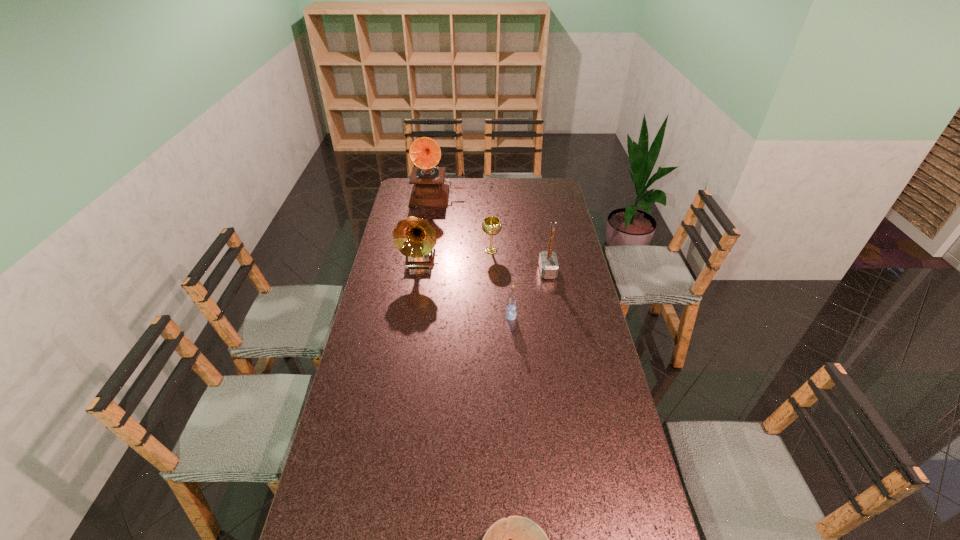
I want to click on vacant space in between the rightmost object and the shorter phonograph_record, so click(484, 266).

What are the coordinates of `vacant space in between the second nearest object and the rightmost object` in the screenshot? It's located at pos(529,294).

Locate an element on the screen. vacant region between the vodka and the tallest object is located at coordinates (474, 256).

In order to click on vacant point located between the hammer and the chalice in this screenshot , I will do `click(519, 261)`.

Identify which object is the third nearest to the second nearest object. Please provide its 2D coordinates. Your answer should be formatted as a tuple, i.e. [(x, y)], where the tuple contains the x and y coordinates of a point satisfying the conditions above.

[(415, 238)]

Where is `object that stands as the closest to the chalice`? object that stands as the closest to the chalice is located at coordinates (548, 263).

Locate an element on the screen. Image resolution: width=960 pixels, height=540 pixels. free space that satisfies the following two spatial constraints: 1. on the horn of the vodka; 2. on the right side of the farther phonograph_record is located at coordinates (420, 317).

Where is `free space that satisfies the following two spatial constraints: 1. on the horn of the vodka; 2. on the right side of the tallest object`? The height and width of the screenshot is (540, 960). free space that satisfies the following two spatial constraints: 1. on the horn of the vodka; 2. on the right side of the tallest object is located at coordinates (420, 317).

I want to click on free space that satisfies the following two spatial constraints: 1. on the horn of the second nearest object; 2. on the right side of the nearer phonograph_record, so click(411, 317).